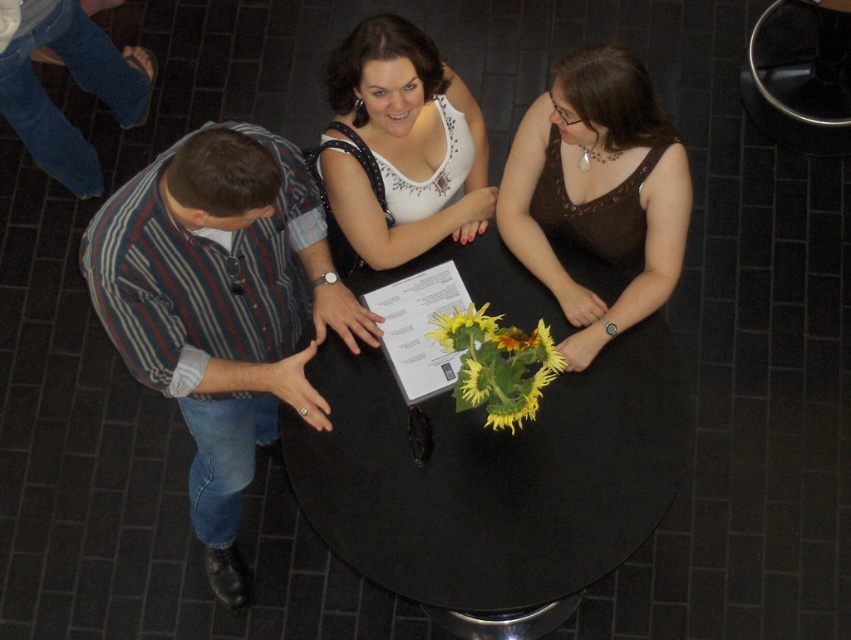
You are standing in the room and want to hand a note to the person wearing the striped cotton shirt at left without disturbing the yellow matte sunflowers at center. Which direction should you move towards?

You should move towards the left side of the room because the striped cotton shirt at left is positioned to the left of the yellow matte sunflowers at center, so moving left will allow you to reach the striped cotton shirt at left without affecting the sunflowers.

You are a florist arranging flowers for a table. You have a black matte table at center and yellow matte sunflowers at center. According to the scene, where should you place the sunflowers relative to the table?

The black matte table at center is positioned on the left side of yellow matte sunflowers at center, so the sunflowers should be placed to the right of the table.

You are standing in the room and want to walk from point A to point B. Point A is at coordinate point (505,166) and point B is at coordinate point (440,326). Which point is closer to you when you are facing the room normally?

Point A at coordinate point (505,166) is closer to you because it is further to the viewer than point B at coordinate point (440,326).